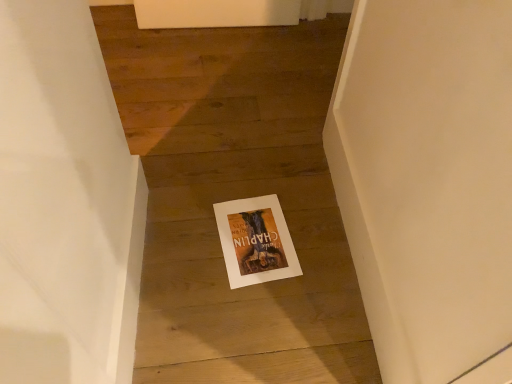
I want to click on vacant space behind white paper at center, so click(x=256, y=174).